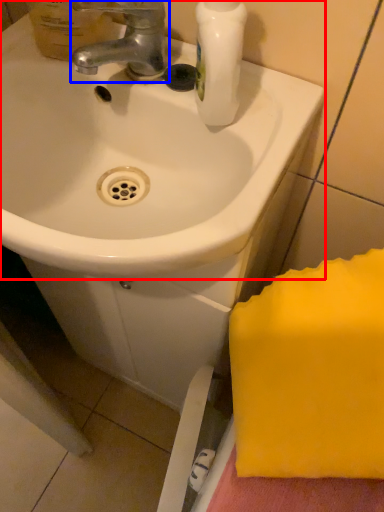
Question: Which object appears closest to the camera in this image, sink (highlighted by a red box) or tap (highlighted by a blue box)?

Choices:
 (A) sink
 (B) tap

Answer: (A)